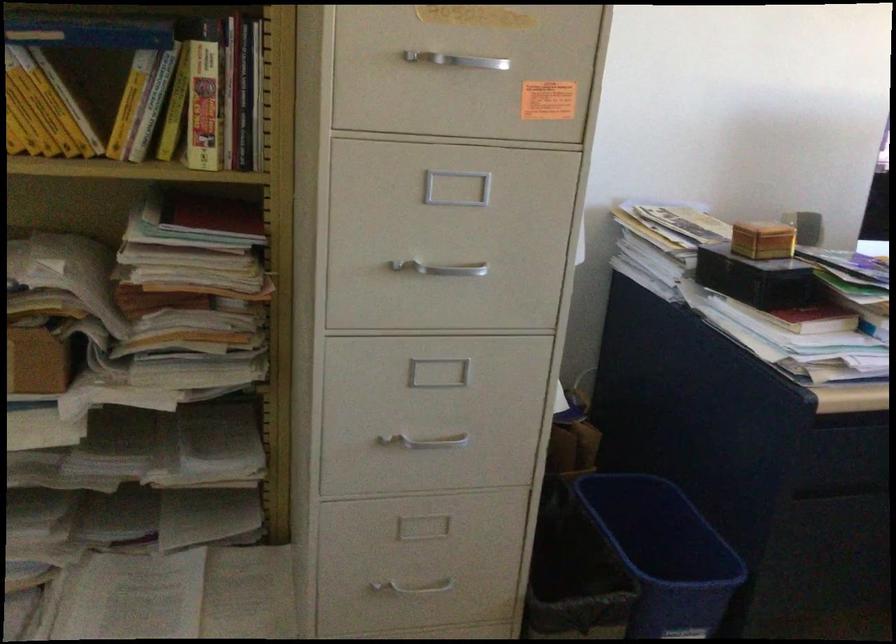
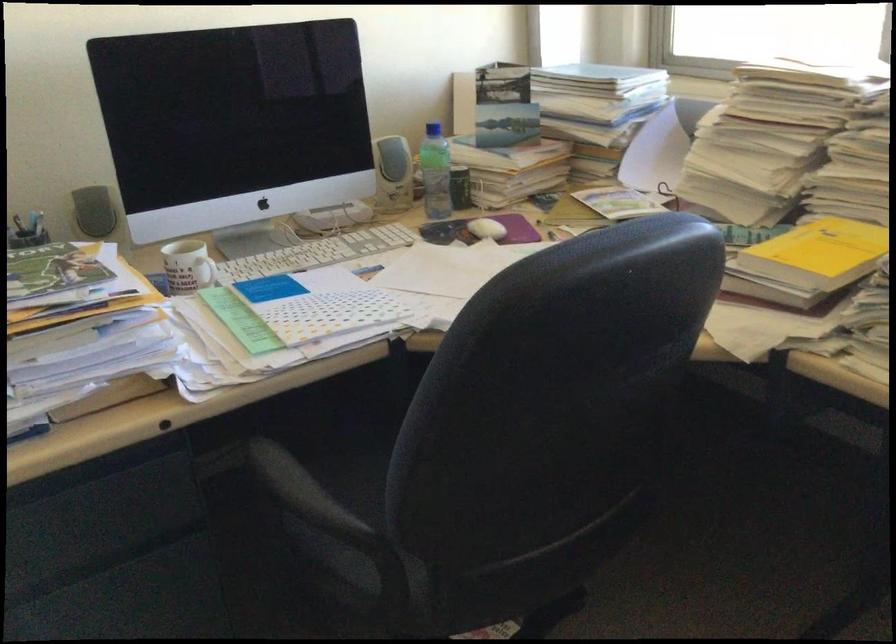
Where in the second image is the point corresponding to (x=812, y=230) from the first image?

(93, 211)